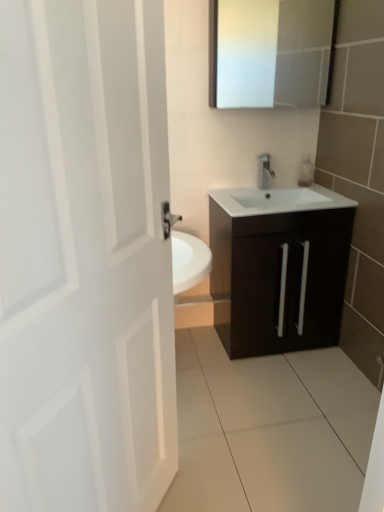
The height and width of the screenshot is (512, 384). In order to click on vacant area situated to the left side of satin nickel faucet at center in this screenshot , I will do `click(239, 192)`.